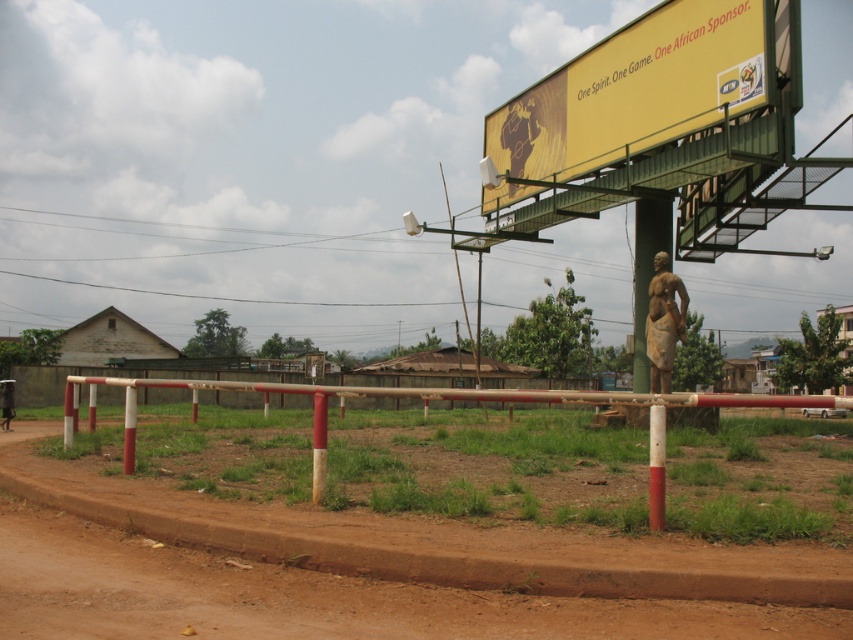
Question: Among these objects, which one is nearest to the camera?

Choices:
 (A) red matte pole at center
 (B) yellow matte billboard at upper right
 (C) bronze statue at center

Answer: (A)

Question: Among these objects, which one is nearest to the camera?

Choices:
 (A) red matte pole at center
 (B) white painted wood barrier at center
 (C) brown dirt field at center

Answer: (C)

Question: Is yellow matte billboard at upper right to the left of bronze statue at center from the viewer's perspective?

Choices:
 (A) yes
 (B) no

Answer: (A)

Question: Does white painted wood barrier at center appear over red matte pole at center?

Choices:
 (A) no
 (B) yes

Answer: (A)

Question: Which object appears closest to the camera in this image?

Choices:
 (A) yellow matte billboard at upper right
 (B) bronze statue at center

Answer: (A)

Question: Can you confirm if yellow matte billboard at upper right is positioned to the right of bronze statue at center?

Choices:
 (A) no
 (B) yes

Answer: (A)